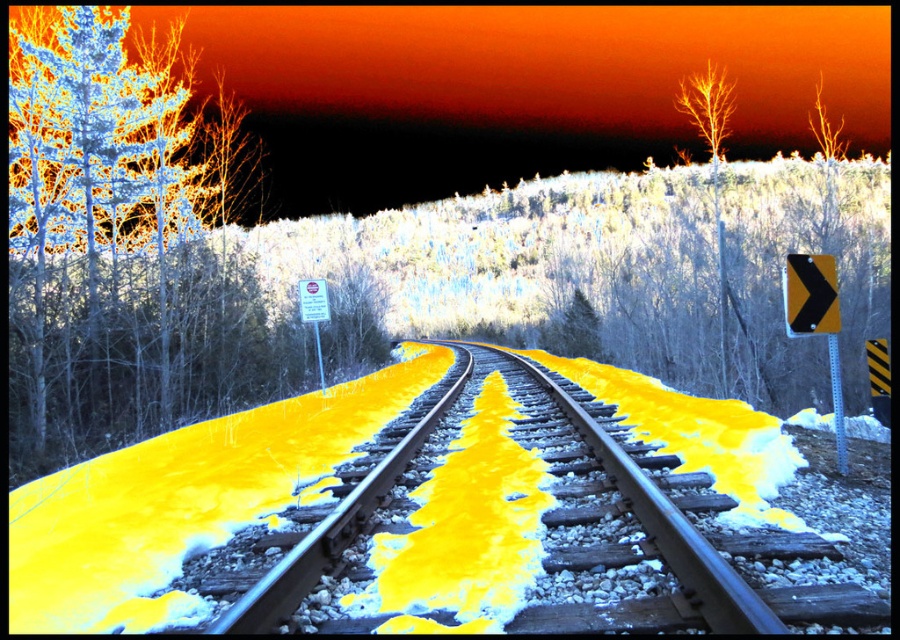
Question: Does wooden railroad tracks at center appear on the left side of bare wood tree at upper right?

Choices:
 (A) yes
 (B) no

Answer: (A)

Question: Which is farther from the bare wood tree at upper right?

Choices:
 (A) white matte tree at upper left
 (B) wooden railroad tracks at center

Answer: (B)

Question: Considering the real-world distances, which object is farthest from the wooden railroad tracks at center?

Choices:
 (A) bare wood tree at upper right
 (B) white matte tree at upper left

Answer: (A)

Question: Can you confirm if white matte tree at upper left is positioned to the left of bare wood tree at upper right?

Choices:
 (A) no
 (B) yes

Answer: (B)

Question: Can you confirm if white matte tree at upper left is positioned above bare wood tree at upper right?

Choices:
 (A) no
 (B) yes

Answer: (A)

Question: Estimate the real-world distances between objects in this image. Which object is farther from the white matte tree at upper left?

Choices:
 (A) wooden railroad tracks at center
 (B) bare wood tree at upper right

Answer: (B)